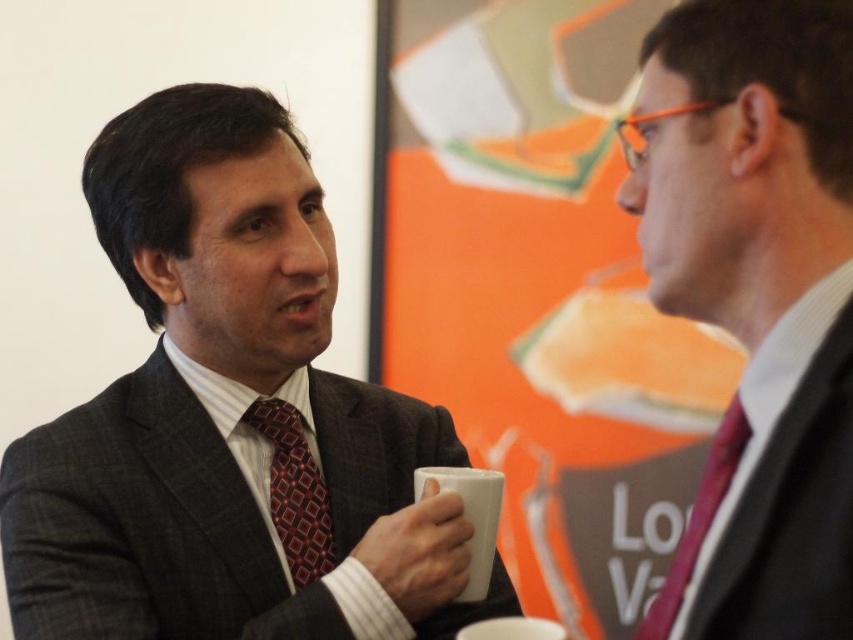
Who is more distant from viewer, (335,465) or (495,531)?

The point (335,465) is behind.

Locate an element on the screen. Image resolution: width=853 pixels, height=640 pixels. matte black suit at left is located at coordinates (x=229, y=419).

Identify the location of matte black suit at left. This screenshot has height=640, width=853. (229, 419).

Who is taller, pink satin tie at right or white matte mug at center?

Standing taller between the two is pink satin tie at right.

Is pink satin tie at right below white matte mug at center?

No, pink satin tie at right is not below white matte mug at center.

You are a GUI agent. You are given a task and a screenshot of the screen. Output one action in this format:
    pyautogui.click(x=<x>, y=<y>)
    Task: Click on the pink satin tie at right
    The height and width of the screenshot is (640, 853).
    Given the screenshot: What is the action you would take?
    pyautogui.click(x=697, y=522)

The width and height of the screenshot is (853, 640). In order to click on pink satin tie at right in this screenshot , I will do `click(697, 522)`.

Who is lower down, dark red textured tie at left or white matte mug at center?

white matte mug at center is below.

Who is more distant from viewer, (270, 508) or (482, 496)?

The point (270, 508) is more distant.

Where is `dark red textured tie at left`? dark red textured tie at left is located at coordinates (294, 490).